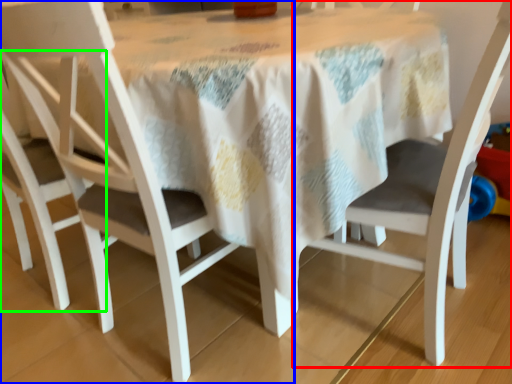
Question: Estimate the real-world distances between objects in this image. Which object is farther from chair (highlighted by a red box), chair (highlighted by a blue box) or chair (highlighted by a green box)?

Choices:
 (A) chair
 (B) chair

Answer: (B)